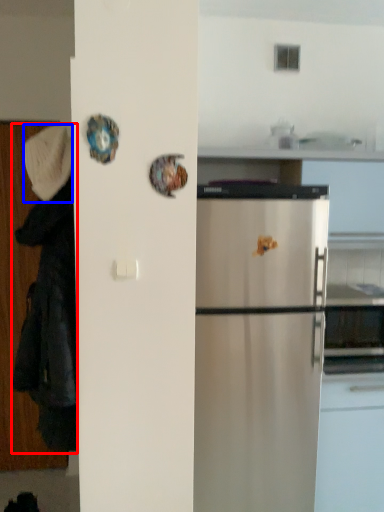
Question: Which point is further to the camera, couple (highlighted by a red box) or hat (highlighted by a blue box)?

Choices:
 (A) couple
 (B) hat

Answer: (B)